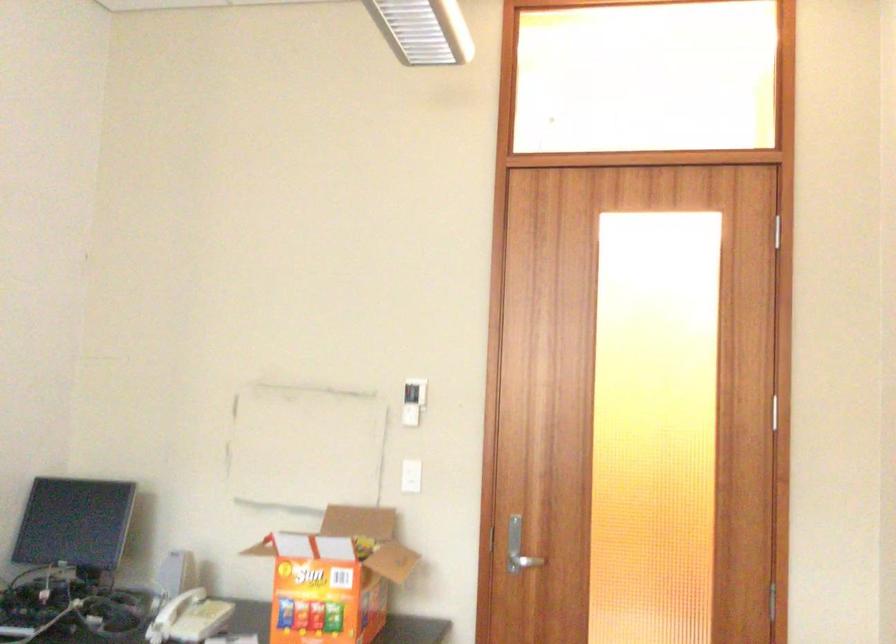
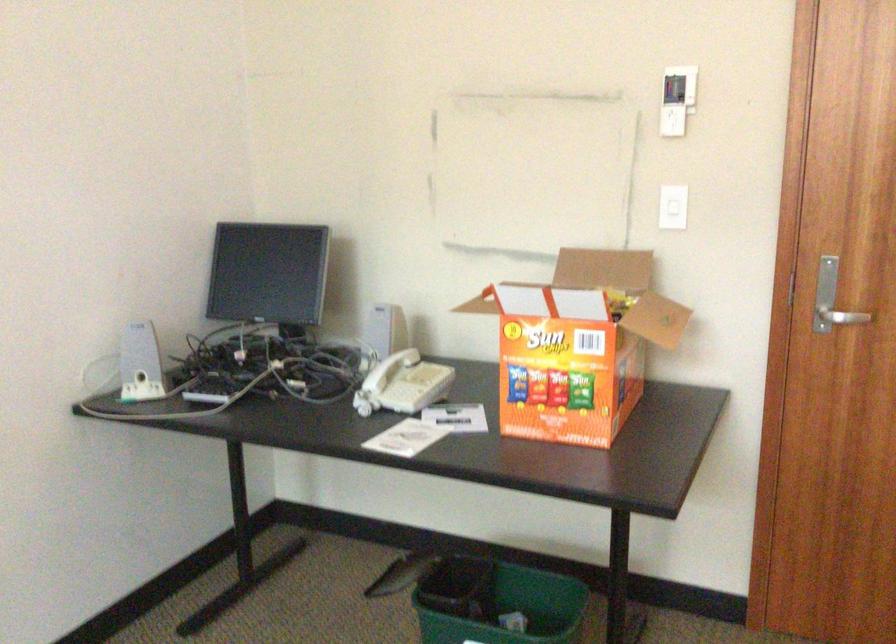
In the second image, find the point that corresponds to point 409,483 in the first image.

(672, 214)